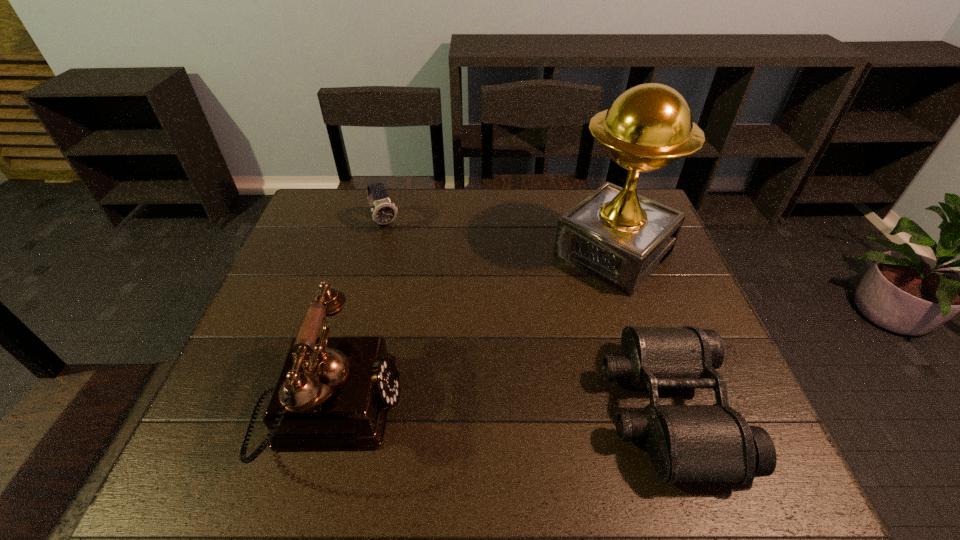
Identify which object is the second closest to the watch. Please provide its 2D coordinates. Your answer should be formatted as a tuple, i.e. [(x, y)], where the tuple contains the x and y coordinates of a point satisfying the conditions above.

[(615, 235)]

I want to click on free point that satisfies the following two spatial constraints: 1. on the front side of the watch; 2. through the eyepieces of the binoculars, so click(338, 408).

Locate an element on the screen. free point that satisfies the following two spatial constraints: 1. on the front side of the award; 2. through the eyepieces of the binoculars is located at coordinates (664, 408).

This screenshot has width=960, height=540. What are the coordinates of `free location that satisfies the following two spatial constraints: 1. on the front side of the shortest object; 2. through the eyepieces of the watch` in the screenshot? It's located at (338, 408).